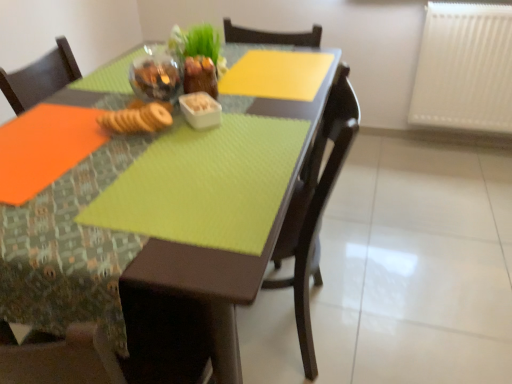
This screenshot has height=384, width=512. What are the coordinates of `free space in front of white plastic container at center, the 1th tableware when ordered from right to left` in the screenshot? It's located at (199, 155).